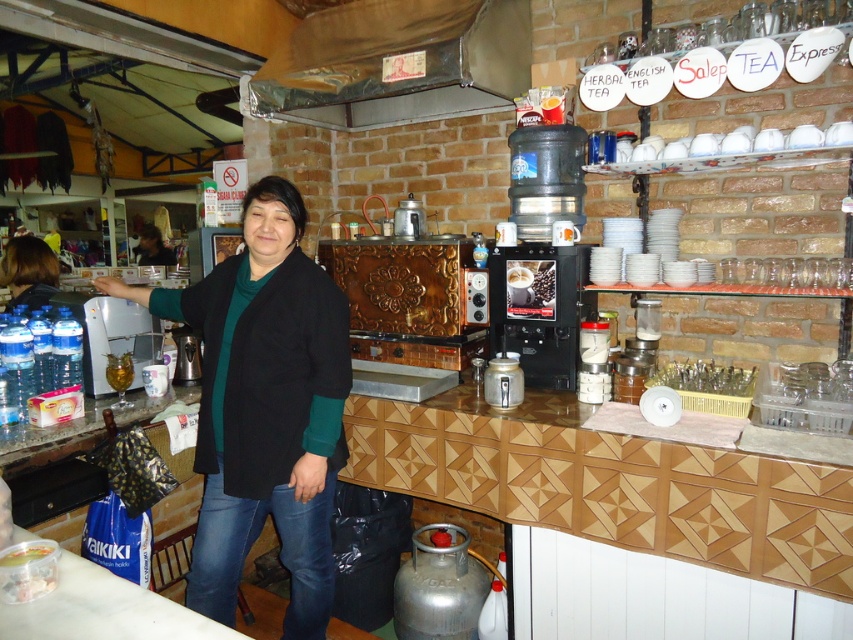
From the picture: You are a customer in the cozy cafe and want to place your dark green fabric jacket at center and translucent plastic bag at lower left on the counter. Which item should you place first to ensure both fit on the counter?

The dark green fabric jacket at center might be wider than the translucent plastic bag at lower left, so you should place the translucent plastic bag at lower left first to ensure both fit on the counter.

You are a customer in the cafe and you want to put your dark green fabric jacket at center and translucent plastic bag at lower left into a single storage compartment. Which item will take up more space?

The dark green fabric jacket at center is bigger than the translucent plastic bag at lower left, so it will take up more space.